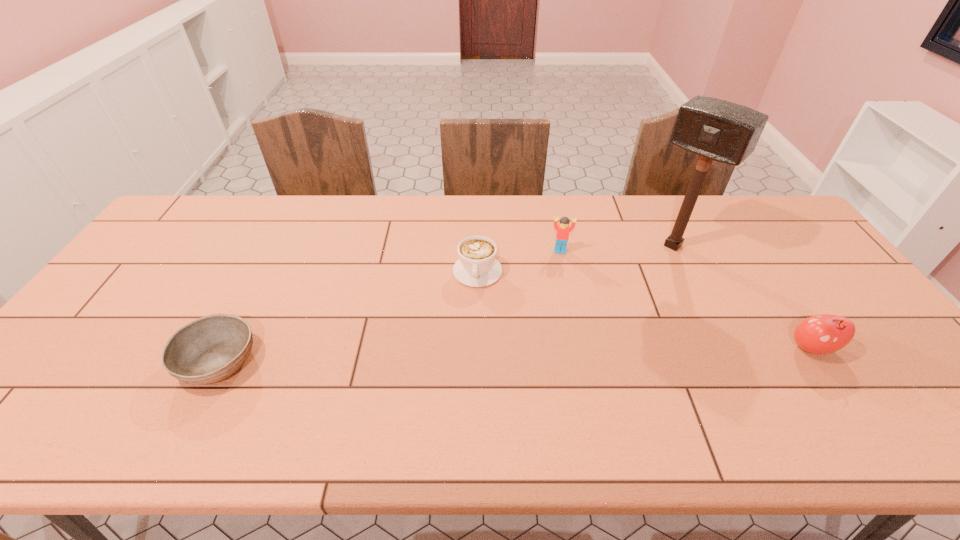
The image size is (960, 540). I want to click on free spot between the second object from right to left and the Lego, so click(x=616, y=248).

You are a GUI agent. You are given a task and a screenshot of the screen. Output one action in this format:
    pyautogui.click(x=<x>, y=<y>)
    Task: Click on the free space that is in between the apple and the fourth object from left to right
    The image size is (960, 540).
    Given the screenshot: What is the action you would take?
    pyautogui.click(x=742, y=297)

The width and height of the screenshot is (960, 540). Find the location of `free space between the third object from left to right and the second object from left to right`. free space between the third object from left to right and the second object from left to right is located at coordinates (518, 261).

You are a GUI agent. You are given a task and a screenshot of the screen. Output one action in this format:
    pyautogui.click(x=<x>, y=<y>)
    Task: Click on the empty space that is in between the leftmost object and the tallest object
    This screenshot has height=540, width=960.
    Given the screenshot: What is the action you would take?
    pyautogui.click(x=446, y=303)

The image size is (960, 540). Identify the location of vacant area that lies between the fourth object from right to left and the second object from right to left. (575, 259).

Identify the location of vacant point located between the rightmost object and the Lego. (685, 300).

You are a GUI agent. You are given a task and a screenshot of the screen. Output one action in this format:
    pyautogui.click(x=<x>, y=<y>)
    Task: Click on the free space that is in between the second object from right to left and the leftmost object
    
    Given the screenshot: What is the action you would take?
    pyautogui.click(x=446, y=303)

This screenshot has width=960, height=540. Find the location of `empty location between the shortest object and the second object from left to right`. empty location between the shortest object and the second object from left to right is located at coordinates (348, 317).

Identify the location of the fourth closest object to the rightmost object. point(209,349).

Locate an element on the screen. The image size is (960, 540). the closest object to the mallet is located at coordinates (563, 229).